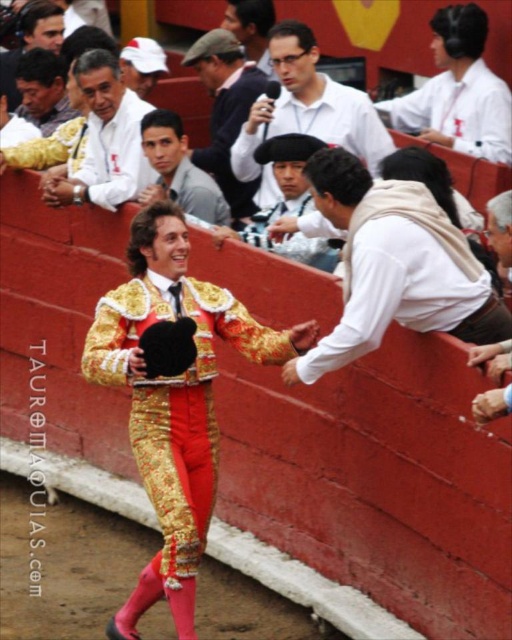
Measure the distance from matte white shirt at upper center to smooth skin face at center.

The distance of matte white shirt at upper center from smooth skin face at center is 16.90 feet.

Can you confirm if matte white shirt at upper center is smaller than smooth skin face at center?

Correct, matte white shirt at upper center occupies less space than smooth skin face at center.

What do you see at coordinates (306, 112) in the screenshot? The image size is (512, 640). I see `matte white shirt at upper center` at bounding box center [306, 112].

At what (x,y) coordinates should I click in order to perform the action: click on matte white shirt at upper center. Please return your answer as a coordinate pair (x, y). The image size is (512, 640). Looking at the image, I should click on (306, 112).

Between white fabric headband at upper center and smooth leather jacket at upper left, which one has less height?

Standing shorter between the two is white fabric headband at upper center.

Between white fabric headband at upper center and smooth leather jacket at upper left, which one appears on the left side from the viewer's perspective?

smooth leather jacket at upper left is more to the left.

Find the location of a particular element. The width and height of the screenshot is (512, 640). white fabric headband at upper center is located at coordinates (458, 92).

The image size is (512, 640). I want to click on matte white shirt at upper center, so click(306, 112).

Is point (285, 115) positioned behind point (9, 65)?

No, it is not.

This screenshot has height=640, width=512. I want to click on matte white shirt at upper center, so click(x=306, y=112).